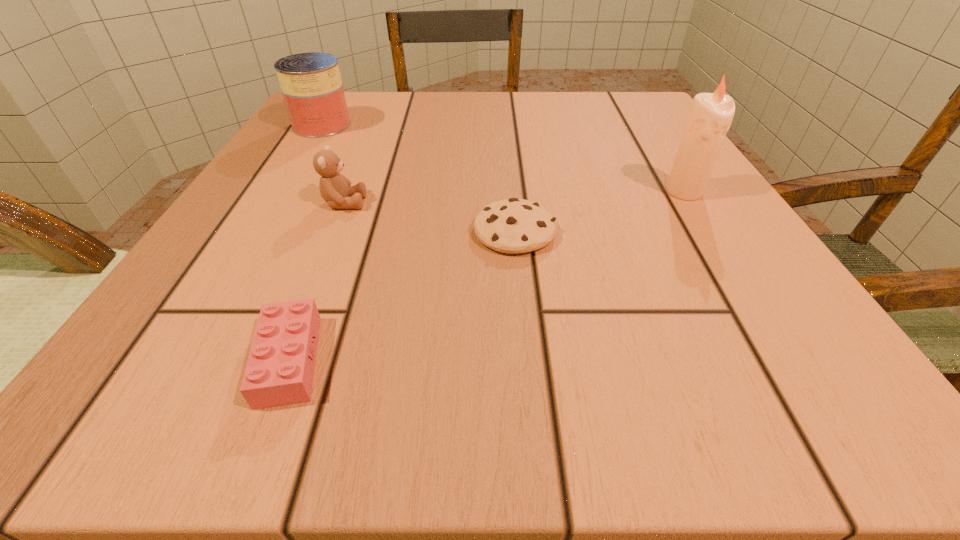
The height and width of the screenshot is (540, 960). I want to click on the tallest object, so click(711, 115).

This screenshot has height=540, width=960. Find the location of `candle`. candle is located at coordinates (711, 115).

At what (x,y) coordinates should I click in order to perform the action: click on can. Please return your answer as a coordinate pair (x, y). The height and width of the screenshot is (540, 960). Looking at the image, I should click on (311, 85).

The width and height of the screenshot is (960, 540). Identify the location of the leftmost object. (311, 85).

Locate an element on the screen. teddy bear is located at coordinates (335, 189).

At what (x,y) coordinates should I click in order to perform the action: click on cookie. Please return your answer as a coordinate pair (x, y). Looking at the image, I should click on (514, 225).

At what (x,y) coordinates should I click in order to perform the action: click on the nearest object. Please return your answer as a coordinate pair (x, y). This screenshot has height=540, width=960. Looking at the image, I should click on (280, 369).

I want to click on vacant region located on the front of the rightmost object, so click(807, 389).

At what (x,y) coordinates should I click in order to perform the action: click on blank space located 0.120m on the front of the leftmost object. Please return your answer as a coordinate pair (x, y). Image resolution: width=960 pixels, height=540 pixels. Looking at the image, I should click on (295, 170).

At what (x,y) coordinates should I click in order to perform the action: click on vacant region located on the face of the teddy bear. Please return your answer as a coordinate pair (x, y). The image size is (960, 540). Looking at the image, I should click on (516, 203).